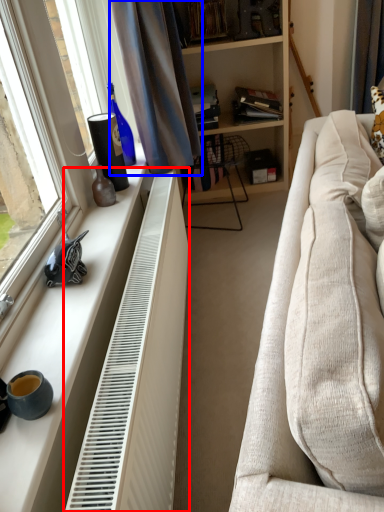
Question: Among these objects, which one is farthest to the camera, radiator (highlighted by a red box) or curtain (highlighted by a blue box)?

Choices:
 (A) radiator
 (B) curtain

Answer: (B)